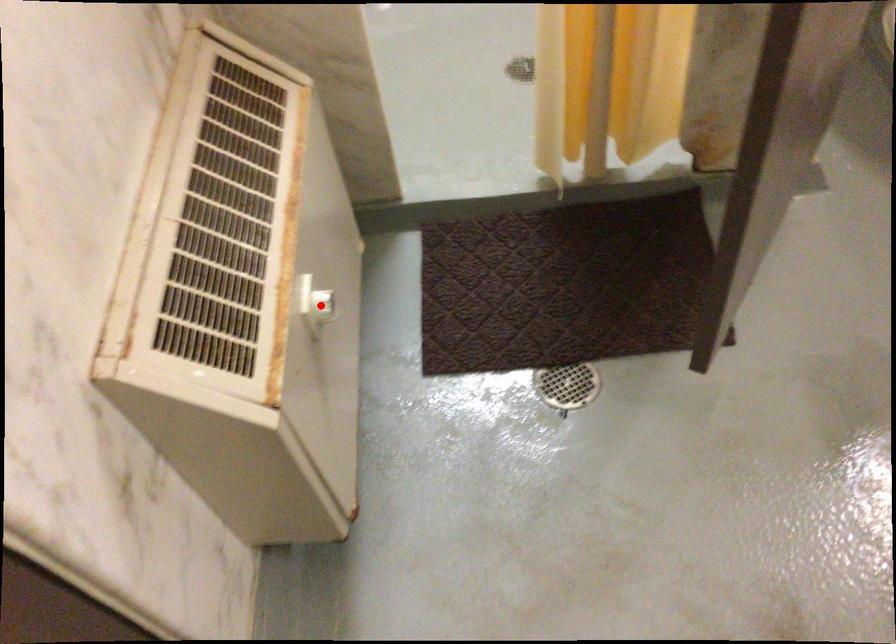
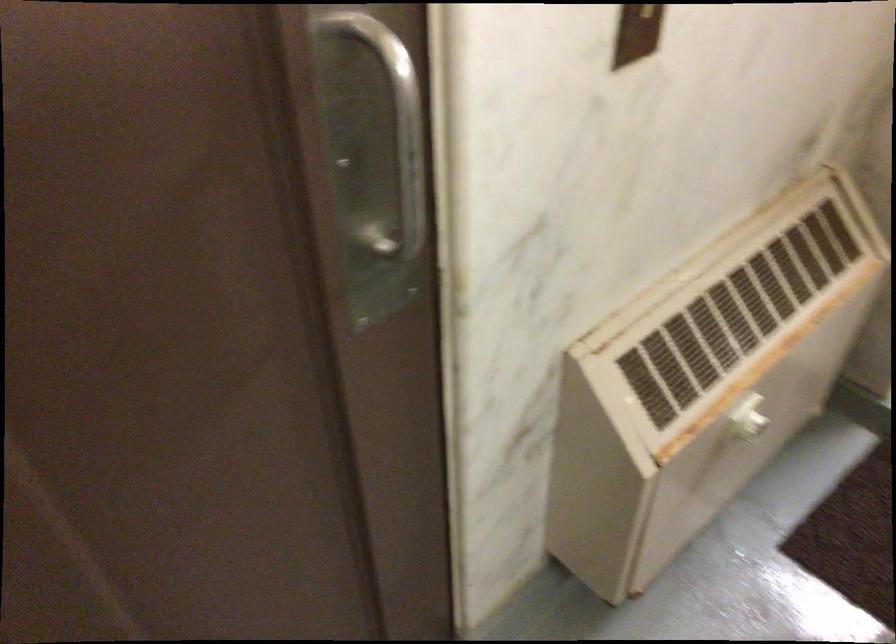
In the second image, find the point that corresponds to the highlighted location in the first image.

(746, 418)